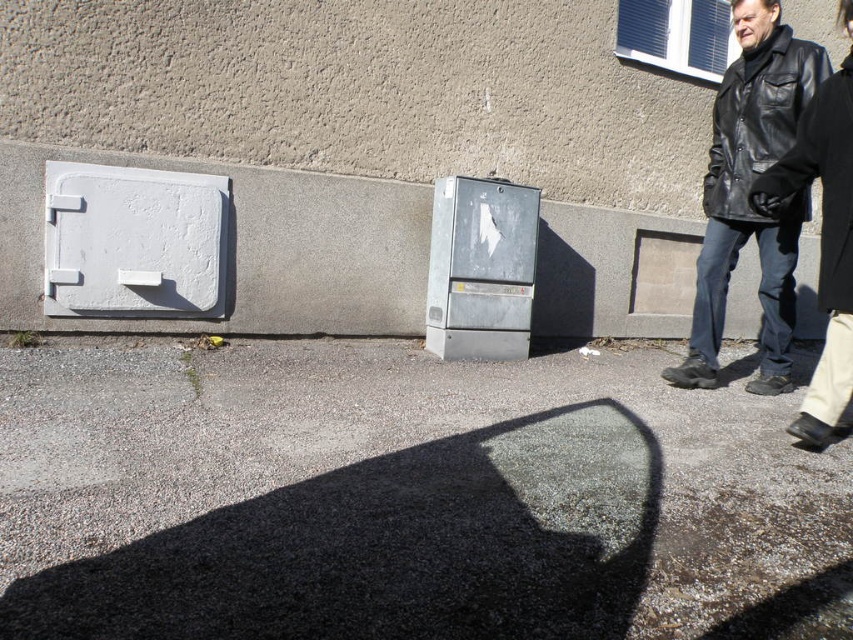
You are standing in front of the wall with the door and electrical box. There are two points marked on the pavement in front of you. The first point is at coordinate point (685, 362) and the second is at point (836, 154). If you want to place a small marker on the point that is closer to your current position, which coordinate should you choose?

You should choose point (836, 154) because it is closer to your current position than point (685, 362).